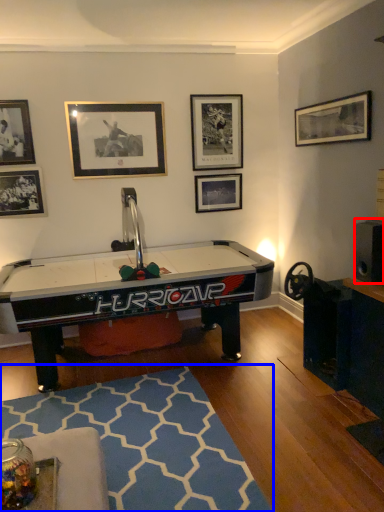
Question: Among these objects, which one is farthest to the camera, speaker (highlighted by a red box) or mat (highlighted by a blue box)?

Choices:
 (A) speaker
 (B) mat

Answer: (A)